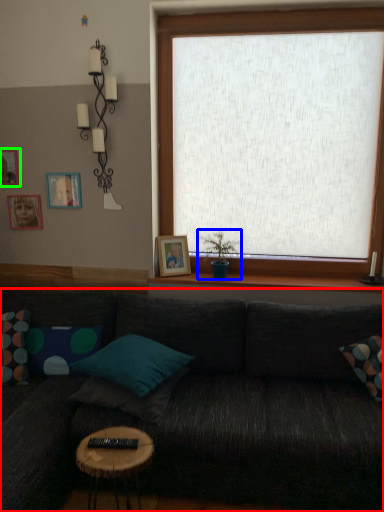
Question: Which object is the farthest from studio couch (highlighted by a red box)? Choose among these: houseplant (highlighted by a blue box) or picture frame (highlighted by a green box).

Choices:
 (A) houseplant
 (B) picture frame

Answer: (B)